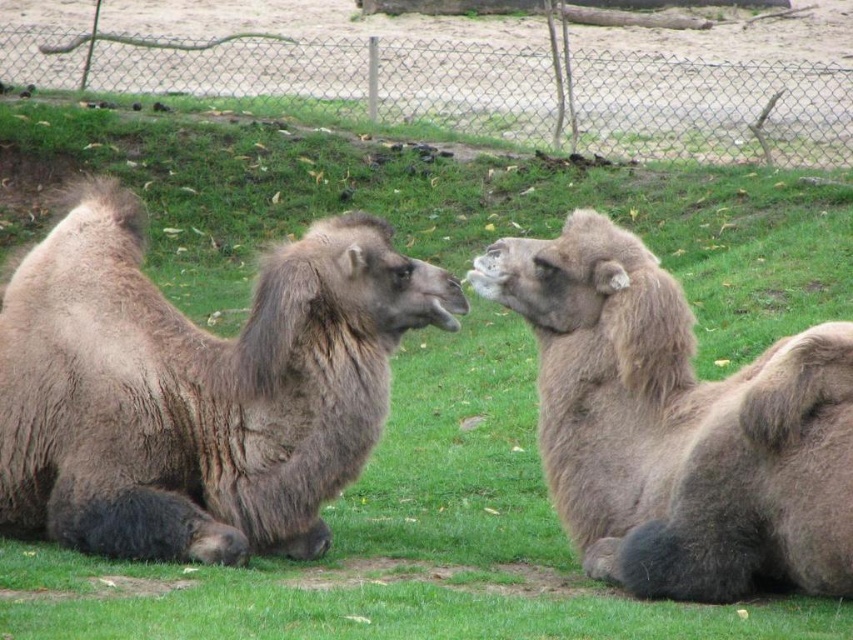
Question: Is brown fuzzy camel at left positioned in front of fuzzy brown camel at center?

Choices:
 (A) no
 (B) yes

Answer: (A)

Question: Among these objects, which one is farthest from the camera?

Choices:
 (A) brown fuzzy camel at left
 (B) wire mesh fence at upper center

Answer: (B)

Question: Which object is closer to the camera taking this photo?

Choices:
 (A) wire mesh fence at upper center
 (B) brown fuzzy camel at left
 (C) fuzzy brown camel at center

Answer: (C)

Question: Which of the following is the closest to the observer?

Choices:
 (A) fuzzy brown camel at center
 (B) brown fuzzy camel at left
 (C) wire mesh fence at upper center

Answer: (A)

Question: In this image, where is fuzzy brown camel at center located relative to wire mesh fence at upper center?

Choices:
 (A) above
 (B) below

Answer: (B)

Question: Can you confirm if fuzzy brown camel at center is positioned above wire mesh fence at upper center?

Choices:
 (A) yes
 (B) no

Answer: (B)